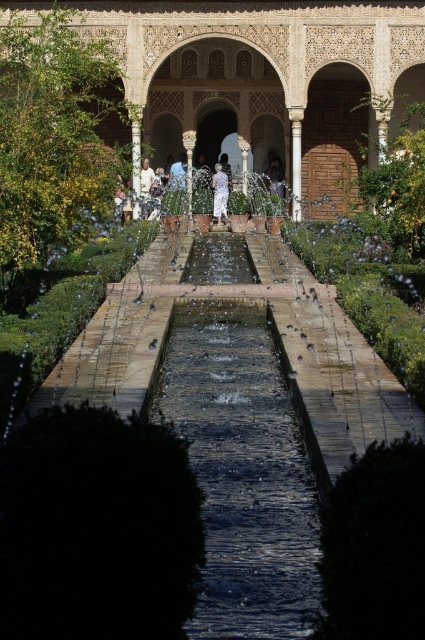
Question: Which point appears farthest from the camera in this image?

Choices:
 (A) (139, 154)
 (B) (221, 216)
 (C) (362, 19)
 (D) (269, 586)

Answer: (B)

Question: Can you confirm if white marble pillar at center is positioned to the left of white cotton dress at center?

Choices:
 (A) yes
 (B) no

Answer: (B)

Question: Where is matte stone pillar at center located in relation to white cotton dress at center in the image?

Choices:
 (A) above
 (B) below

Answer: (A)

Question: Which point appears farthest from the camera in this image?

Choices:
 (A) (311, 128)
 (B) (294, 176)
 (C) (136, 200)
 (D) (269, 163)

Answer: (D)

Question: Which of the following is the farthest from the observer?

Choices:
 (A) clear water at center
 (B) matte white palace at center
 (C) white marble pillar at center
 (D) white cotton dress at center

Answer: (D)

Question: Does clear water at center appear on the right side of white marble pillar at center?

Choices:
 (A) no
 (B) yes

Answer: (A)